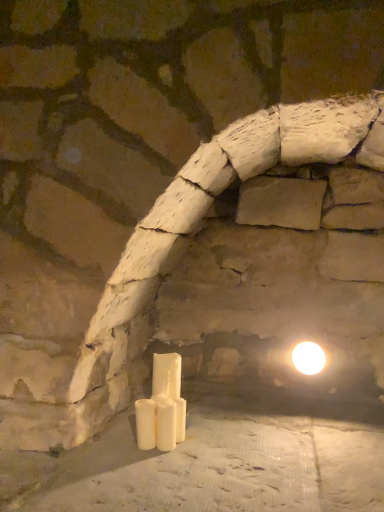
Question: Is white glossy light bulb at upper right to the left or to the right of white glossy candle at center, which is the third candle in front-to-back order, in the image?

Choices:
 (A) left
 (B) right

Answer: (B)

Question: Is white glossy light bulb at upper right spatially inside white glossy candle at center, which is the third candle in front-to-back order, or outside of it?

Choices:
 (A) outside
 (B) inside

Answer: (A)

Question: Which object is positioned farthest from the white matte candle at lower center, which is the 2th candle in front-to-back order?

Choices:
 (A) white glossy light bulb at upper right
 (B) white matte candle at center, which is the 3th candle from back to front
 (C) white glossy candle at center, which is the third candle in front-to-back order

Answer: (A)

Question: Considering the real-world distances, which object is closest to the white glossy light bulb at upper right?

Choices:
 (A) white glossy candle at center, the first candle positioned from the back
 (B) white matte candle at lower center, which is the 2th candle in front-to-back order
 (C) white matte candle at center, which is the 3th candle from back to front

Answer: (A)